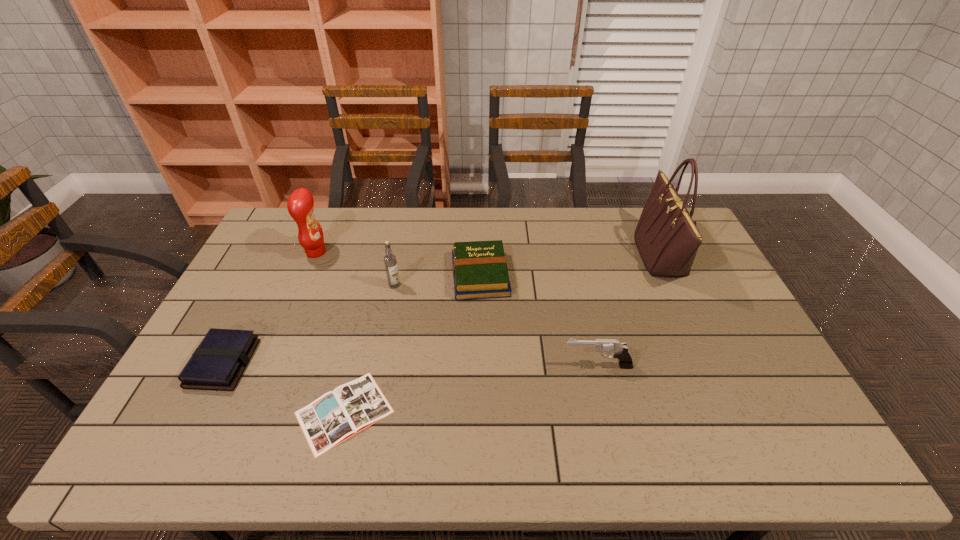
This screenshot has width=960, height=540. Find the location of `vacant region at the far edge of the desktop`. vacant region at the far edge of the desktop is located at coordinates (557, 237).

Image resolution: width=960 pixels, height=540 pixels. What are the coordinates of `vacant region at the right edge of the desktop` in the screenshot? It's located at (703, 275).

The width and height of the screenshot is (960, 540). Find the location of `free point between the fifth shortest object and the fifth tallest object`. free point between the fifth shortest object and the fifth tallest object is located at coordinates (438, 280).

The height and width of the screenshot is (540, 960). I want to click on free space between the second object from right to left and the sixth object from right to left, so click(457, 309).

Identify the location of vacant region between the rightmost book and the second tallest object. The image size is (960, 540). (398, 264).

Identify the location of free point between the sixth tallest object and the condiment. This screenshot has height=540, width=960. (270, 308).

I want to click on vacant area between the farthest book and the shortest book, so click(x=412, y=343).

You are a GUI agent. You are given a task and a screenshot of the screen. Output one action in this format:
    pyautogui.click(x=<x>, y=<y>)
    Task: Click on the vacant area between the second book from left to right and the rightmost object
    Image resolution: width=960 pixels, height=540 pixels.
    Given the screenshot: What is the action you would take?
    pyautogui.click(x=502, y=334)

The width and height of the screenshot is (960, 540). Find the location of `unoccupied position between the vodka and the condiment`. unoccupied position between the vodka and the condiment is located at coordinates (355, 269).

Identify the location of empty space that is in between the second shortest object and the rightmost object. This screenshot has height=540, width=960. (442, 309).